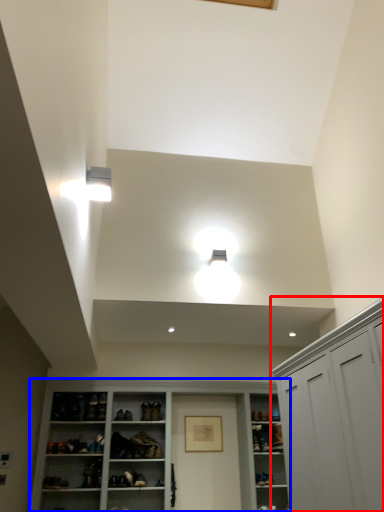
Question: Which object is closer to the camera taking this photo, cabinetry (highlighted by a red box) or cupboard (highlighted by a blue box)?

Choices:
 (A) cabinetry
 (B) cupboard

Answer: (A)